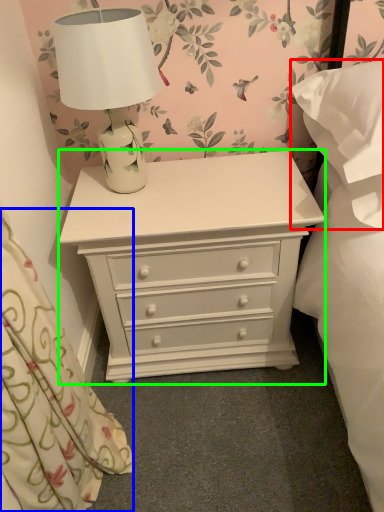
Question: Considering the real-world distances, which object is farthest from pillow (highlighted by a red box)? curtain (highlighted by a blue box) or chest of drawers (highlighted by a green box)?

Choices:
 (A) curtain
 (B) chest of drawers

Answer: (A)